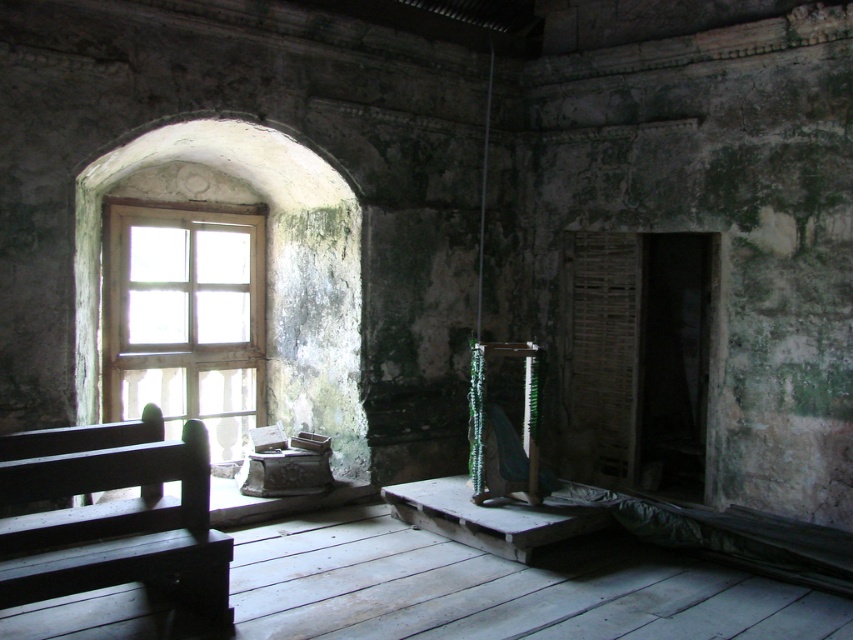
Question: Which point is closer to the camera?

Choices:
 (A) wooden at left
 (B) dark wood bench at left

Answer: (B)

Question: Does dark wood bench at left appear on the right side of wooden at left?

Choices:
 (A) no
 (B) yes

Answer: (B)

Question: Can you confirm if dark wood bench at left is thinner than wooden at left?

Choices:
 (A) no
 (B) yes

Answer: (A)

Question: Is dark wood bench at left smaller than wooden at left?

Choices:
 (A) no
 (B) yes

Answer: (B)